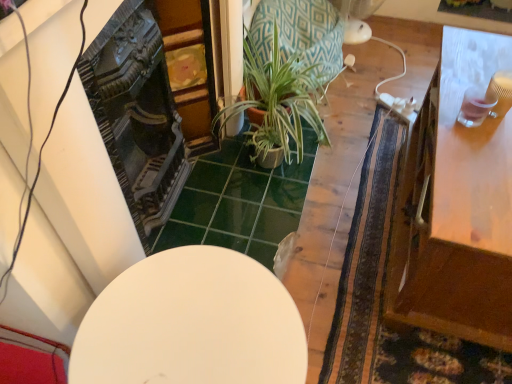
Question: Is white matte table at center, which ranks as the first table in left-to-right order, at the right side of green textured pot at center?

Choices:
 (A) yes
 (B) no

Answer: (B)

Question: Can you confirm if white matte table at center, the second table positioned from the right, is taller than green textured pot at center?

Choices:
 (A) yes
 (B) no

Answer: (A)

Question: Is white matte table at center, which ranks as the first table in left-to-right order, outside green textured pot at center?

Choices:
 (A) no
 (B) yes

Answer: (B)

Question: From the image's perspective, would you say white matte table at center, the second table positioned from the right, is shown under green textured pot at center?

Choices:
 (A) no
 (B) yes

Answer: (B)

Question: Considering their positions, is white matte table at center, the second table positioned from the right, located in front of or behind wooden table at right, marked as the second table in a left-to-right arrangement?

Choices:
 (A) front
 (B) behind

Answer: (A)

Question: Is white matte table at center, which ranks as the first table in left-to-right order, spatially inside wooden table at right, marked as the second table in a left-to-right arrangement, or outside of it?

Choices:
 (A) inside
 (B) outside

Answer: (B)

Question: From a real-world perspective, is white matte table at center, the second table positioned from the right, above or below wooden table at right, the first table from the right?

Choices:
 (A) below
 (B) above

Answer: (A)

Question: Would you say white matte table at center, the second table positioned from the right, is to the left or to the right of wooden table at right, the first table from the right, in the picture?

Choices:
 (A) left
 (B) right

Answer: (A)

Question: In terms of size, does wooden table at right, marked as the second table in a left-to-right arrangement, appear bigger or smaller than white matte table at center, which ranks as the first table in left-to-right order?

Choices:
 (A) big
 (B) small

Answer: (A)

Question: From a real-world perspective, is wooden table at right, the first table from the right, above or below white matte table at center, the second table positioned from the right?

Choices:
 (A) below
 (B) above

Answer: (B)

Question: Is wooden table at right, marked as the second table in a left-to-right arrangement, situated inside white matte table at center, which ranks as the first table in left-to-right order, or outside?

Choices:
 (A) inside
 (B) outside

Answer: (B)

Question: Considering the positions of point (431, 160) and point (231, 319), is point (431, 160) closer or farther from the camera than point (231, 319)?

Choices:
 (A) closer
 (B) farther

Answer: (B)

Question: Is green textured pot at center inside or outside of white matte table at center, the second table positioned from the right?

Choices:
 (A) inside
 (B) outside

Answer: (B)

Question: Relative to white matte table at center, the second table positioned from the right, is green textured pot at center in front or behind?

Choices:
 (A) front
 (B) behind

Answer: (B)